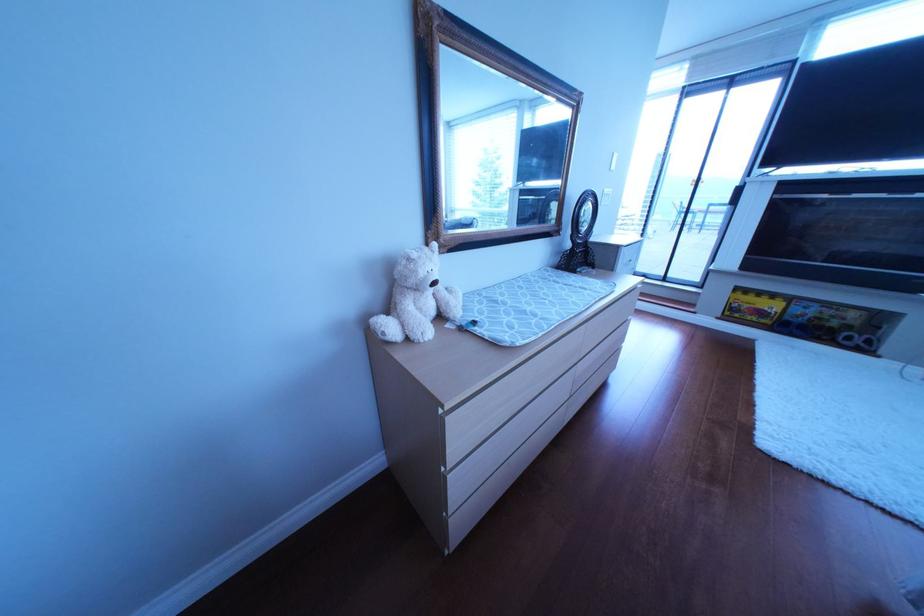
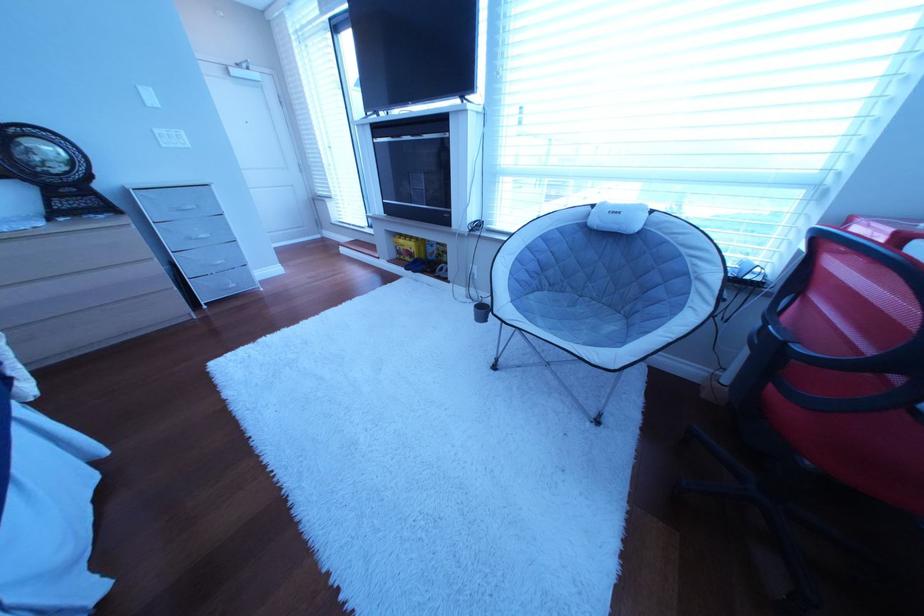
In the second image, find the point that corresponds to (617,206) in the first image.

(179, 148)